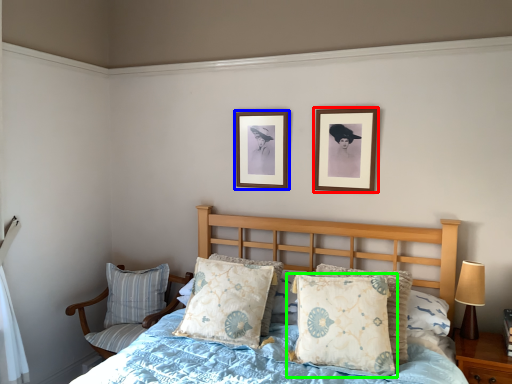
Question: Which is farther away from picture frame (highlighted by a red box)? picture frame (highlighted by a blue box) or pillow (highlighted by a green box)?

Choices:
 (A) picture frame
 (B) pillow

Answer: (B)